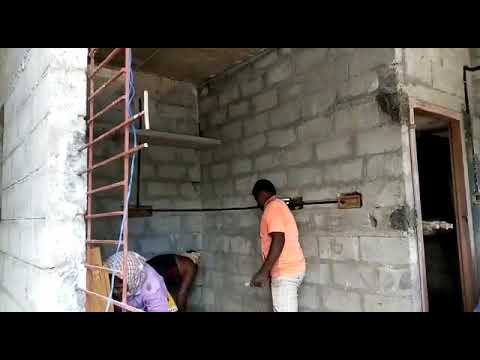
At what (x,y) coordinates should I click in order to perform the action: click on concrete wall. Please return your answer as a coordinate pair (x, y). This screenshot has width=480, height=360. Looking at the image, I should click on (170, 181), (345, 153), (24, 198), (438, 78).